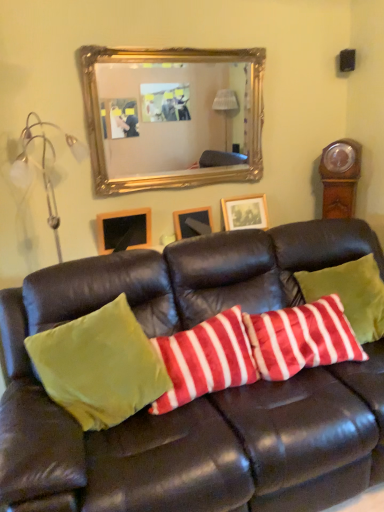
Question: From the image's perspective, is velvety red and white striped pillow at center, positioned as the second pillow in right-to-left order, beneath wooden picture frame at upper left, the 1th picture frame from the left?

Choices:
 (A) no
 (B) yes

Answer: (B)

Question: Is velvety red and white striped pillow at center, positioned as the second pillow in right-to-left order, smaller than wooden picture frame at upper left, which is the third picture frame in right-to-left order?

Choices:
 (A) yes
 (B) no

Answer: (B)

Question: Is wooden picture frame at upper left, which is the third picture frame in right-to-left order, at the back of velvety red and white striped pillow at center, positioned as the second pillow in right-to-left order?

Choices:
 (A) no
 (B) yes

Answer: (A)

Question: Is velvety red and white striped pillow at center, positioned as the second pillow in right-to-left order, outside wooden picture frame at upper left, the 1th picture frame from the left?

Choices:
 (A) yes
 (B) no

Answer: (A)

Question: Is velvety red and white striped pillow at center, positioned as the second pillow in right-to-left order, thinner than wooden picture frame at upper left, which is the third picture frame in right-to-left order?

Choices:
 (A) no
 (B) yes

Answer: (A)

Question: Can you confirm if velvety red and white striped pillow at center, positioned as the second pillow in right-to-left order, is positioned to the right of wooden picture frame at upper left, the 1th picture frame from the left?

Choices:
 (A) yes
 (B) no

Answer: (A)

Question: Could matte white picture frame at center, acting as the 3th picture frame starting from the left, be considered to be inside velvety red and white striped pillow at center, which ranks as the first pillow in right-to-left order?

Choices:
 (A) no
 (B) yes

Answer: (A)

Question: Considering the relative sizes of velvety red and white striped pillow at center, which ranks as the first pillow in right-to-left order, and matte white picture frame at center, acting as the 3th picture frame starting from the left, in the image provided, is velvety red and white striped pillow at center, which ranks as the first pillow in right-to-left order, taller than matte white picture frame at center, acting as the 3th picture frame starting from the left,?

Choices:
 (A) no
 (B) yes

Answer: (B)

Question: Is velvety red and white striped pillow at center, which ranks as the first pillow in right-to-left order, completely or partially outside of matte white picture frame at center, placed as the first picture frame when sorted from right to left?

Choices:
 (A) yes
 (B) no

Answer: (A)

Question: Is velvety red and white striped pillow at center, which ranks as the first pillow in right-to-left order, not close to matte white picture frame at center, placed as the first picture frame when sorted from right to left?

Choices:
 (A) yes
 (B) no

Answer: (B)

Question: Is velvety red and white striped pillow at center, which ranks as the first pillow in right-to-left order, placed right next to matte white picture frame at center, acting as the 3th picture frame starting from the left?

Choices:
 (A) no
 (B) yes

Answer: (A)

Question: Is velvety red and white striped pillow at center, the third pillow when ordered from left to right, bigger than matte white picture frame at center, placed as the first picture frame when sorted from right to left?

Choices:
 (A) yes
 (B) no

Answer: (A)

Question: From a real-world perspective, is velvet green couch at center located higher than wooden grandfather clock at right?

Choices:
 (A) yes
 (B) no

Answer: (B)